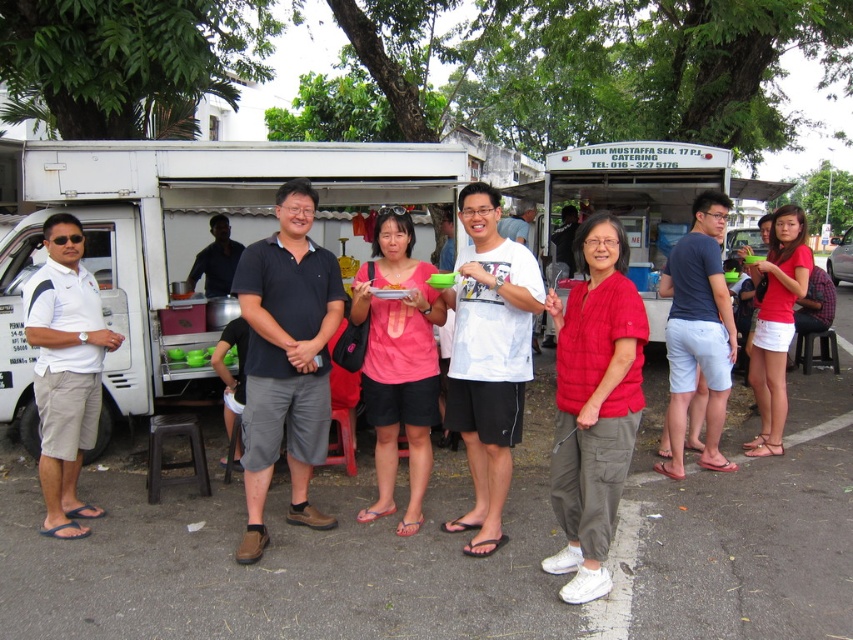
You are standing at the point with coordinates (595, 403). Which object are you standing on?

You are standing on the matte red jacket at center.

You are a photographer trying to capture a photo of the matte red jacket at center and the red matte shorts at lower right. You want to ensure both are in focus. If your camera has a depth of field that can cover 3 meters, will both objects be in focus?

The matte red jacket at center is 2.75 meters away from the red matte shorts at lower right. Since the distance between them is less than 3 meters, both objects will be within the camera depth of field and in focus.